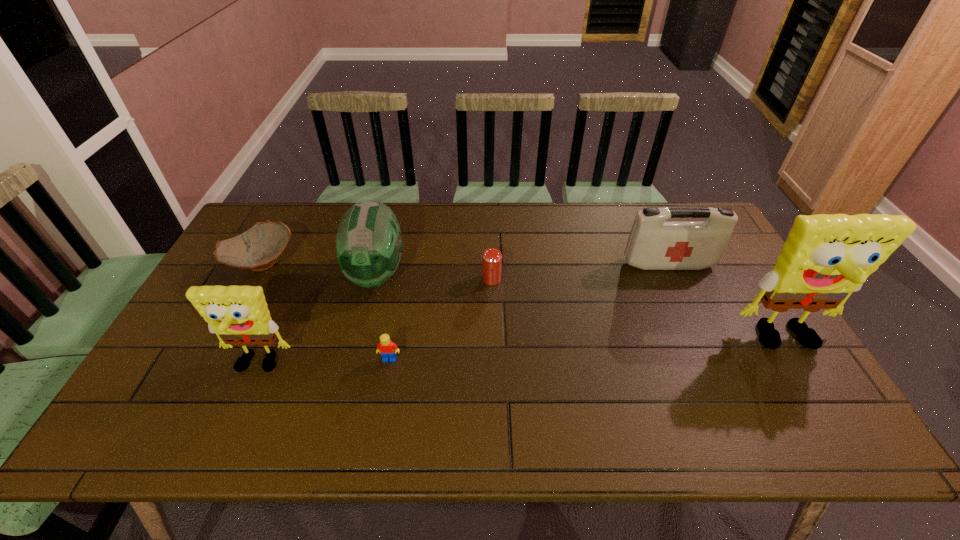
Where is `the left sponge`? This screenshot has height=540, width=960. the left sponge is located at coordinates (239, 315).

This screenshot has width=960, height=540. I want to click on the right sponge, so (825, 258).

Where is `the tallest object`? the tallest object is located at coordinates (825, 258).

Locate an element on the screen. Image resolution: width=960 pixels, height=540 pixels. beer can is located at coordinates (492, 258).

Locate an element on the screen. pottery is located at coordinates (257, 249).

You are a GUI agent. You are given a task and a screenshot of the screen. Output one action in this format:
    pyautogui.click(x=<x>, y=<y>)
    Task: Click on the first-aid kit
    The image size is (960, 540).
    Given the screenshot: What is the action you would take?
    pyautogui.click(x=654, y=244)

Where is `football helmet`? football helmet is located at coordinates (368, 246).

I want to click on Lego, so click(x=387, y=349).

Identify the location of vacant space located 0.110m on the face of the taller sponge. The height and width of the screenshot is (540, 960). (824, 399).

Image resolution: width=960 pixels, height=540 pixels. In order to click on vacant space located 0.350m on the back of the beer can in this screenshot , I will do `click(490, 207)`.